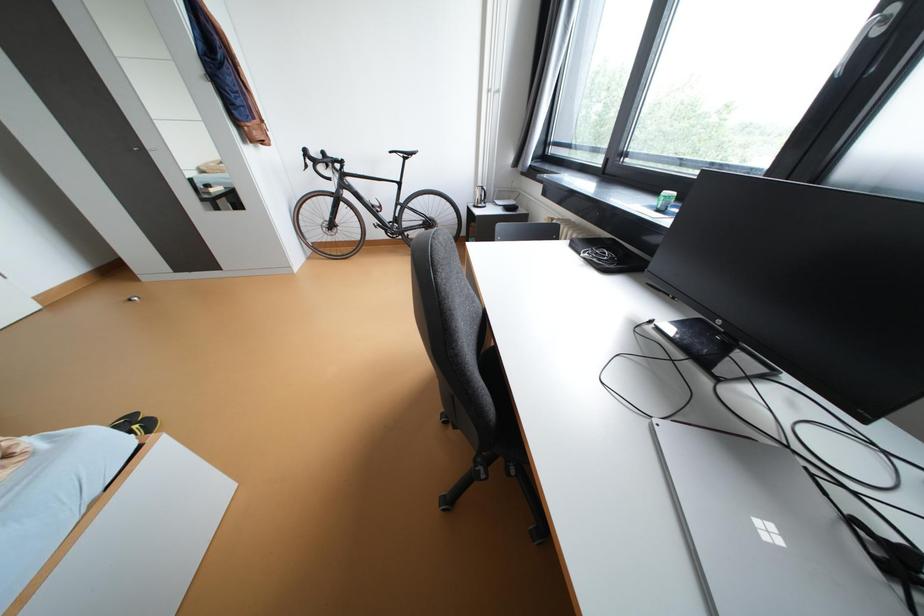
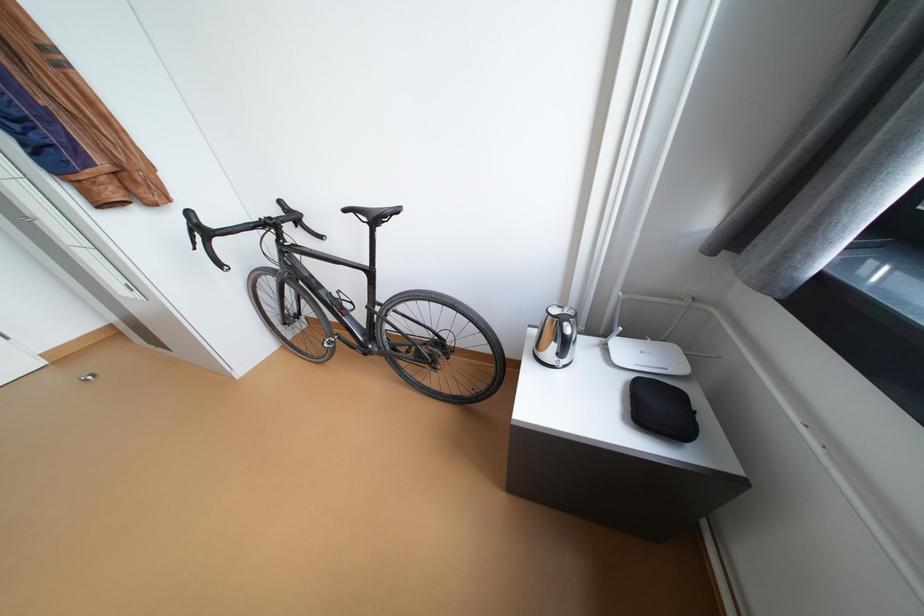
Question: What movement of the cameraman would produce the second image?

Choices:
 (A) Left
 (B) Right
 (C) Forward
 (D) Backward

Answer: (C)